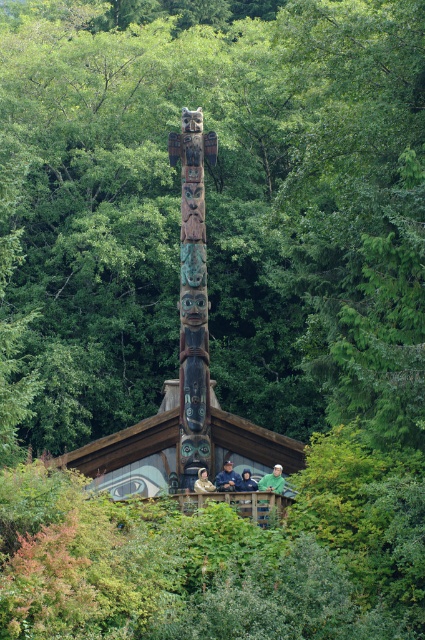
Between wooden hut at center and dark green fabric jacket at center, which one is positioned higher?

wooden hut at center is above.

Between point (96, 488) and point (246, 472), which one is positioned behind?

Positioned behind is point (96, 488).

You are a GUI agent. You are given a task and a screenshot of the screen. Output one action in this format:
    pyautogui.click(x=<x>, y=<y>)
    Task: Click on the wooden hut at center
    This screenshot has width=425, height=640.
    Given the screenshot: What is the action you would take?
    pyautogui.click(x=133, y=452)

Image resolution: width=425 pixels, height=640 pixels. I want to click on wooden hut at center, so click(133, 452).

The image size is (425, 640). Identify the location of wooden hut at center. (133, 452).

Which is in front, point (181, 376) or point (201, 486)?

Point (201, 486) is more forward.

Is carved wooden totem pole at center thinner than light brown wooden person at center?

No, carved wooden totem pole at center is not thinner than light brown wooden person at center.

You are a GUI agent. You are given a task and a screenshot of the screen. Output one action in this format:
    pyautogui.click(x=<x>, y=<y>)
    Task: Click on the carved wooden totem pole at center
    
    Given the screenshot: What is the action you would take?
    pyautogui.click(x=192, y=296)

At what (x,y) coordinates should I click in order to perform the action: click on carved wooden totem pole at center. Please return your answer as a coordinate pair (x, y). Looking at the image, I should click on click(192, 296).